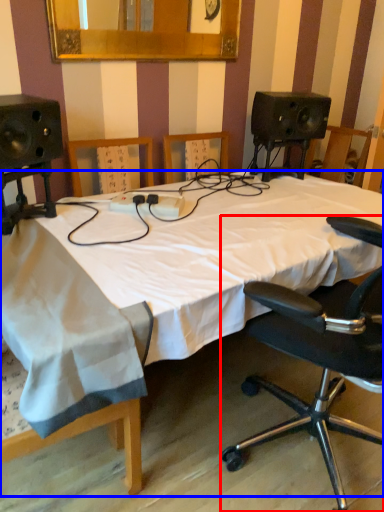
Question: Which object is further to the camera taking this photo, chair (highlighted by a red box) or bed (highlighted by a blue box)?

Choices:
 (A) chair
 (B) bed

Answer: (B)